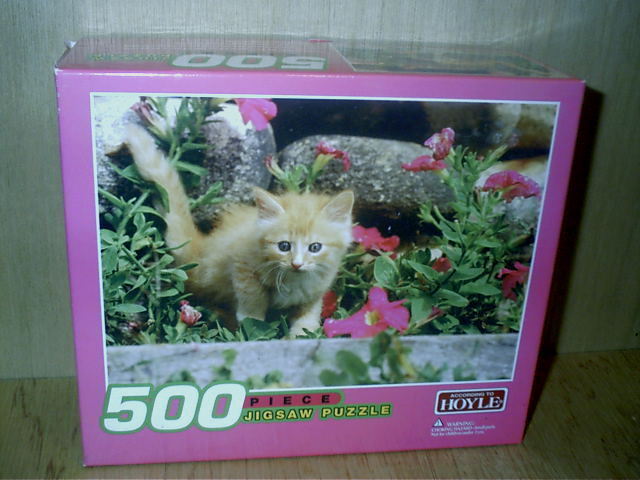
This screenshot has height=480, width=640. Identify the location of green leafy plants. (166, 263), (125, 251), (132, 214), (438, 296), (390, 275), (434, 267), (479, 238), (468, 174), (468, 155), (139, 307).